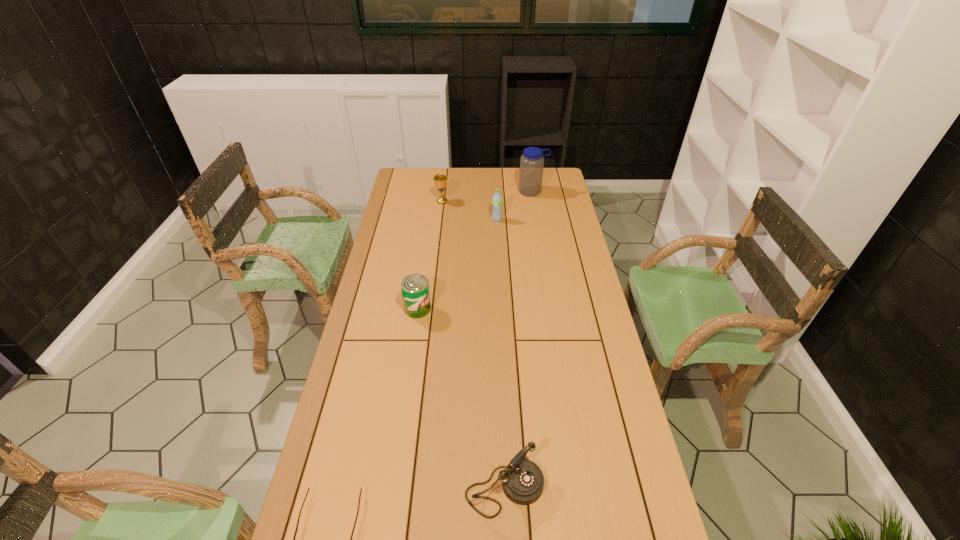
Where is `the rightmost object`? This screenshot has width=960, height=540. the rightmost object is located at coordinates (532, 161).

The height and width of the screenshot is (540, 960). In order to click on the right water bottle in this screenshot , I will do `click(532, 161)`.

Image resolution: width=960 pixels, height=540 pixels. Identify the location of the third farthest object. (497, 198).

Find the location of a particular element. The image size is (960, 540). the shorter water bottle is located at coordinates (497, 198).

You are a GUI agent. You are given a task and a screenshot of the screen. Output one action in this format:
    pyautogui.click(x=<x>, y=<y>)
    Task: Click on the second farthest object
    Image resolution: width=960 pixels, height=540 pixels.
    Given the screenshot: What is the action you would take?
    pyautogui.click(x=440, y=180)

Identify the location of can. This screenshot has height=540, width=960. (415, 289).

This screenshot has height=540, width=960. In order to click on telephone in this screenshot , I will do `click(522, 480)`.

Where is `free space located 0.390m with a carrying loop on the side of the farthest object`? Image resolution: width=960 pixels, height=540 pixels. free space located 0.390m with a carrying loop on the side of the farthest object is located at coordinates (541, 246).

The width and height of the screenshot is (960, 540). Find the location of `vacant space situated 0.190m on the back of the left water bottle`. vacant space situated 0.190m on the back of the left water bottle is located at coordinates (495, 195).

At what (x,y) coordinates should I click in order to perform the action: click on vacant space positioned 0.350m on the right of the chalice. Please return your answer as a coordinate pair (x, y). Looking at the image, I should click on (520, 201).